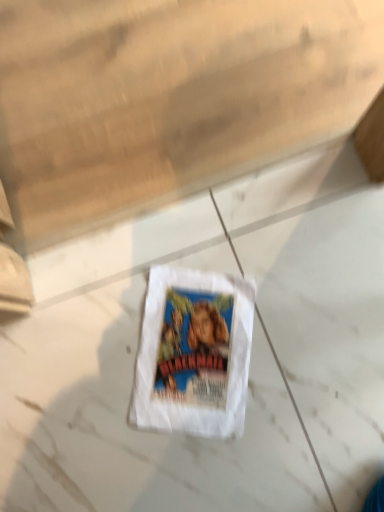
In order to click on free space above white paper grocery bag at center (from a real-world perspective) in this screenshot , I will do `click(198, 349)`.